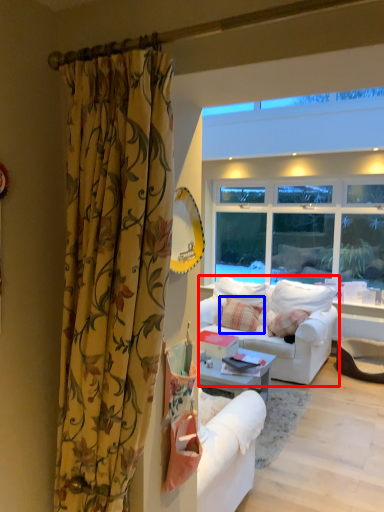
Question: Which of the following is the closest to the observer, studio couch (highlighted by a red box) or pillow (highlighted by a blue box)?

Choices:
 (A) studio couch
 (B) pillow

Answer: (A)